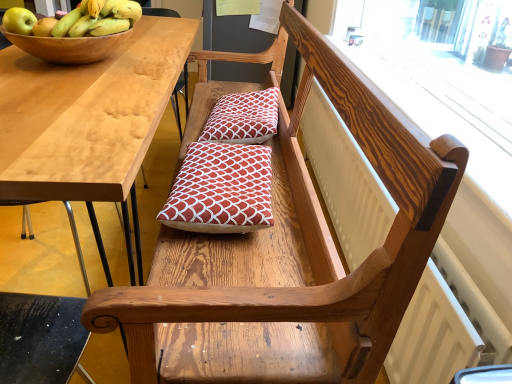
Image resolution: width=512 pixels, height=384 pixels. Identify the location of yellow matte bananas at upper left. (77, 20).

Measure the distance between yellow matte bananas at upper left and camera.

The distance of yellow matte bananas at upper left from camera is 3.51 feet.

Measure the distance between point [110,47] and camera.

Point [110,47] is 3.79 feet away from camera.

The image size is (512, 384). Describe the element at coordinates (89, 123) in the screenshot. I see `light wood table at left` at that location.

Identify the location of white textured radiator at upper right. (444, 326).

Find the location of `yellow matte bananas at upper left`. yellow matte bananas at upper left is located at coordinates (77, 20).

Considering the points (421, 351) and (58, 29), which point is in front, point (421, 351) or point (58, 29)?

The point (421, 351) is more forward.

Between white textured radiator at upper right and yellow matte bananas at upper left, which one has larger size?

Bigger between the two is white textured radiator at upper right.

Is white textured radiator at upper right to the right of yellow matte bananas at upper left from the viewer's perspective?

Yes, white textured radiator at upper right is to the right of yellow matte bananas at upper left.

Based on the photo, is yellow matte bananas at upper left a part of white textured radiator at upper right?

No.

Is red printed cushion at center, the 1th pillow in the back-to-front sequence, bigger or smaller than light wood table at left?

red printed cushion at center, the 1th pillow in the back-to-front sequence, is smaller than light wood table at left.

At what (x,y) coordinates should I click in order to perform the action: click on desk that is in front of the red printed cushion at center, the 2th pillow when ordered from bottom to top. Please return your answer as a coordinate pair (x, y). Looking at the image, I should click on (89, 123).

In the image, is red printed cushion at center, the 1th pillow in the back-to-front sequence, on the left side or the right side of light wood table at left?

From the image, it's evident that red printed cushion at center, the 1th pillow in the back-to-front sequence, is to the right of light wood table at left.

Which is correct: green matte apple at upper left is inside light wood table at left, or outside of it?

green matte apple at upper left lies outside light wood table at left.

Where is `apple behind the light wood table at left`? The width and height of the screenshot is (512, 384). apple behind the light wood table at left is located at coordinates (19, 21).

From the image's perspective, which object appears higher, green matte apple at upper left or light wood table at left?

green matte apple at upper left.

Is light wood table at left surrounding yellow matte bananas at upper left?

No, light wood table at left does not contain yellow matte bananas at upper left.

From the image's perspective, is light wood table at left beneath yellow matte bananas at upper left?

Yes, from the image's perspective, light wood table at left is below yellow matte bananas at upper left.

From a real-world perspective, which object stands above the other?

yellow matte bananas at upper left is physically above.

Considering the sizes of light wood table at left and yellow matte bananas at upper left in the image, is light wood table at left taller or shorter than yellow matte bananas at upper left?

light wood table at left is taller than yellow matte bananas at upper left.

Is white textured radiator at upper right to the left or to the right of light wood table at left in the image?

Based on their positions, white textured radiator at upper right is located to the right of light wood table at left.

At what (x,y) coordinates should I click in order to perform the action: click on radiator lying below the light wood table at left (from the image's perspective). Please return your answer as a coordinate pair (x, y). The image size is (512, 384). Looking at the image, I should click on (444, 326).

Based on the photo, does white textured radiator at upper right have a lesser width compared to light wood table at left?

Indeed, white textured radiator at upper right has a lesser width compared to light wood table at left.

From the image's perspective, is white textured radiator at upper right over light wood table at left?

Actually, white textured radiator at upper right appears below light wood table at left in the image.

From the image's perspective, is red printed cushion at center, the 2th pillow when ordered from bottom to top, beneath white textured radiator at upper right?

No, from the image's perspective, red printed cushion at center, the 2th pillow when ordered from bottom to top, is not beneath white textured radiator at upper right.

Is red printed cushion at center, positioned as the 1th pillow in top-to-bottom order, in contact with white textured radiator at upper right?

No, red printed cushion at center, positioned as the 1th pillow in top-to-bottom order, is not with white textured radiator at upper right.

Who is smaller, red printed cushion at center, which is counted as the second pillow, starting from the front, or white textured radiator at upper right?

Smaller between the two is red printed cushion at center, which is counted as the second pillow, starting from the front.

How many degrees apart are the facing directions of red printed cushion at center, the 1th pillow in the back-to-front sequence, and white textured radiator at upper right?

The angular difference between red printed cushion at center, the 1th pillow in the back-to-front sequence, and white textured radiator at upper right is 4.19 degrees.

Is wooden bowl at upper left touching white textured radiator at upper right?

wooden bowl at upper left and white textured radiator at upper right are not in contact.

Is white textured radiator at upper right located within wooden bowl at upper left?

Definitely not — white textured radiator at upper right is not inside wooden bowl at upper left.

This screenshot has height=384, width=512. What are the coordinates of `banana above the white textured radiator at upper right (from a real-world perspective)` in the screenshot? It's located at (77, 20).

Find the location of a particular element. The image size is (512, 384). desk below the red printed cushion at center, positioned as the 1th pillow in top-to-bottom order (from the image's perspective) is located at coordinates (89, 123).

Which object lies nearer to the anchor point white textured radiator at upper right, light wood table at left or red printed cushion at center, the 1th pillow in the back-to-front sequence?

red printed cushion at center, the 1th pillow in the back-to-front sequence, lies closer to white textured radiator at upper right than the other object.

Considering their positions, is light wood table at left positioned closer to yellow matte bananas at upper left than green matte apple at upper left?

The object closer to yellow matte bananas at upper left is green matte apple at upper left.

Based on their spatial positions, is red printed cushion at center, which ranks as the second pillow in top-to-bottom order, or light wood table at left closer to wooden bowl at upper left?

light wood table at left is positioned closer to the anchor wooden bowl at upper left.

When comparing their distances from yellow matte bananas at upper left, does green matte apple at upper left or wooden bowl at upper left seem further?

Among the two, green matte apple at upper left is located further to yellow matte bananas at upper left.

From the image, which object appears to be farther from red printed cushion at center, which ranks as the second pillow in top-to-bottom order, green matte apple at upper left or light wood table at left?

The object further to red printed cushion at center, which ranks as the second pillow in top-to-bottom order, is green matte apple at upper left.

Considering their positions, is yellow matte bananas at upper left positioned further to green matte apple at upper left than red printed cushion at center, the first pillow positioned from the bottom?

red printed cushion at center, the first pillow positioned from the bottom, is further to green matte apple at upper left.

Looking at this image, which object lies further to the anchor point white textured radiator at upper right, red printed cushion at center, which is counted as the second pillow, starting from the front, or green matte apple at upper left?

green matte apple at upper left is further to white textured radiator at upper right.

Based on their spatial positions, is light wood table at left or red printed cushion at center, positioned as the 1th pillow in top-to-bottom order, closer to green matte apple at upper left?

light wood table at left is closer to green matte apple at upper left.

At what (x,y) coordinates should I click in order to perform the action: click on bowl between yellow matte bananas at upper left and red printed cushion at center, the 2th pillow when ordered from back to front, in the vertical direction. Please return your answer as a coordinate pair (x, y). This screenshot has height=384, width=512. Looking at the image, I should click on (68, 47).

Find the location of a particular element. This screenshot has width=512, height=384. radiator positioned between light wood table at left and red printed cushion at center, the 2th pillow when ordered from bottom to top, from near to far is located at coordinates (444, 326).

Image resolution: width=512 pixels, height=384 pixels. Find the location of `bowl between green matte apple at upper left and white textured radiator at upper right from left to right`. bowl between green matte apple at upper left and white textured radiator at upper right from left to right is located at coordinates (68, 47).

Find the location of a particular element. The height and width of the screenshot is (384, 512). banana between green matte apple at upper left and red printed cushion at center, the 1th pillow from the front, from left to right is located at coordinates (77, 20).